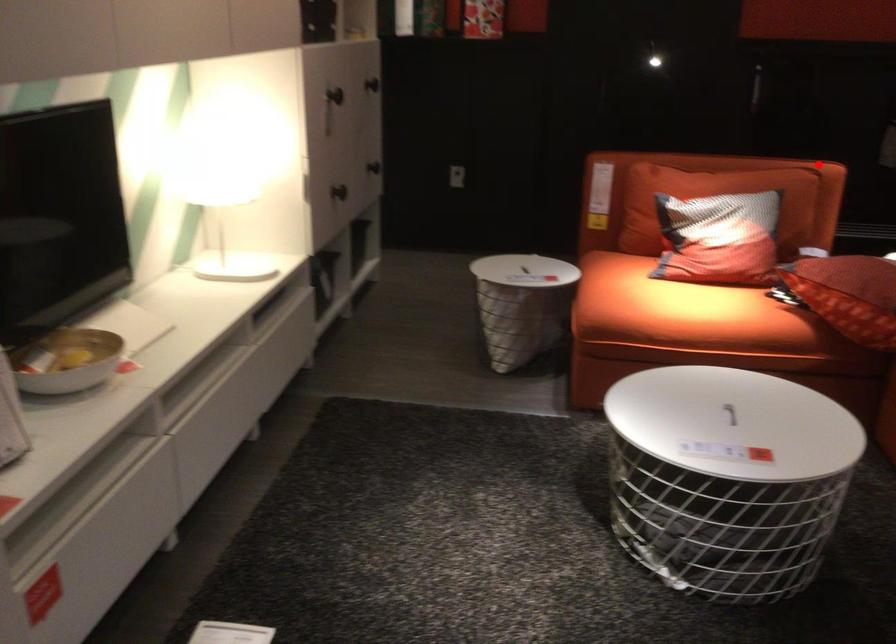
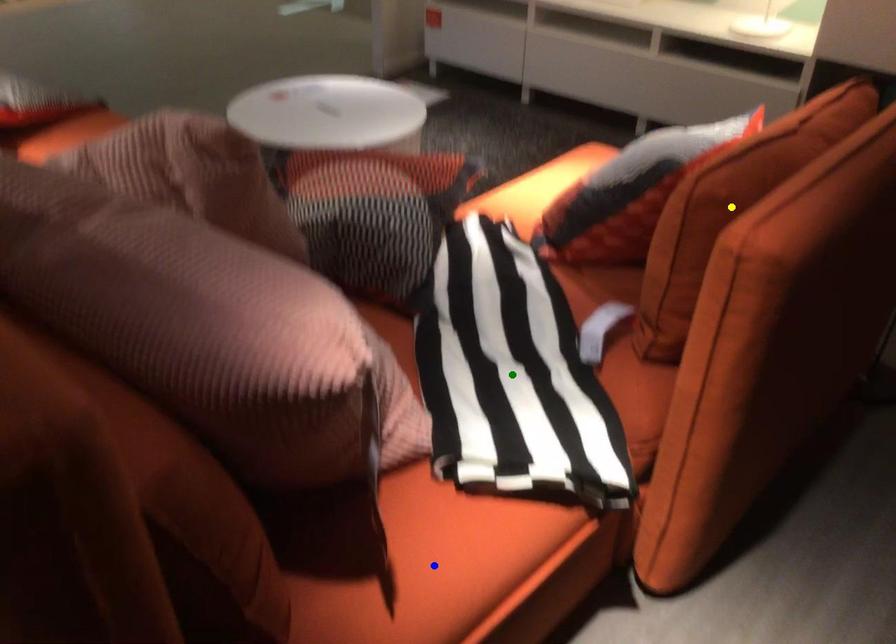
Question: I am providing you with two images of the same scene from different viewpoints. A red point is marked on the first image. You are given multiple points on the second image. Which point in image 2 represents the same 3d spot as the red point in image 1?

Choices:
 (A) blue point
 (B) green point
 (C) yellow point

Answer: (C)